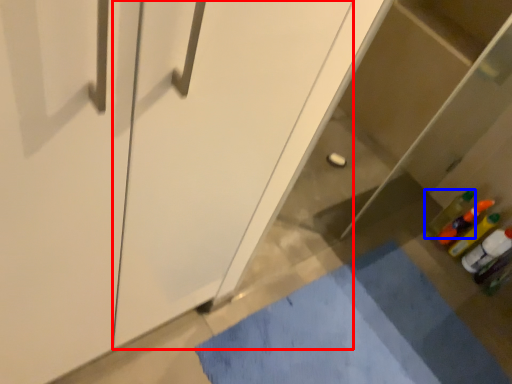
Question: Which point is further to the camera, screen door (highlighted by a red box) or bottle (highlighted by a blue box)?

Choices:
 (A) screen door
 (B) bottle

Answer: (B)